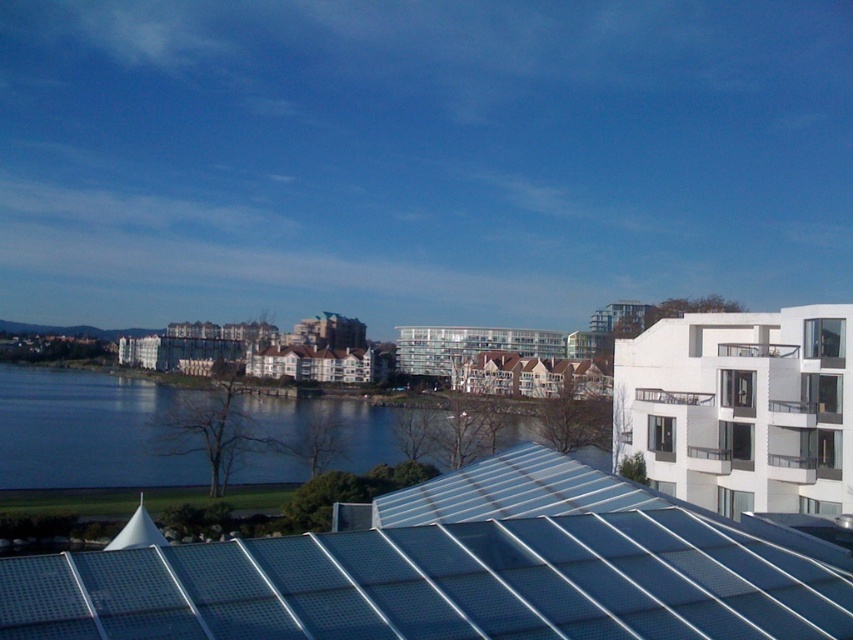
Question: Is metallic silver roof at center positioned at the back of blue water at center?

Choices:
 (A) yes
 (B) no

Answer: (B)

Question: Which object appears closest to the camera in this image?

Choices:
 (A) metallic silver roof at center
 (B) white glass balcony at upper right
 (C) blue water at center

Answer: (A)

Question: Estimate the real-world distances between objects in this image. Which object is farther from the metallic silver roof at center?

Choices:
 (A) white glass balcony at upper right
 (B) blue water at center

Answer: (B)

Question: Can you confirm if metallic silver roof at center is thinner than blue water at center?

Choices:
 (A) no
 (B) yes

Answer: (B)

Question: Which object is closer to the camera taking this photo?

Choices:
 (A) metallic silver roof at center
 (B) white glass balcony at upper right
 (C) blue water at center

Answer: (A)

Question: Considering the relative positions of metallic silver roof at center and white glass balcony at upper right in the image provided, where is metallic silver roof at center located with respect to white glass balcony at upper right?

Choices:
 (A) left
 (B) right

Answer: (A)